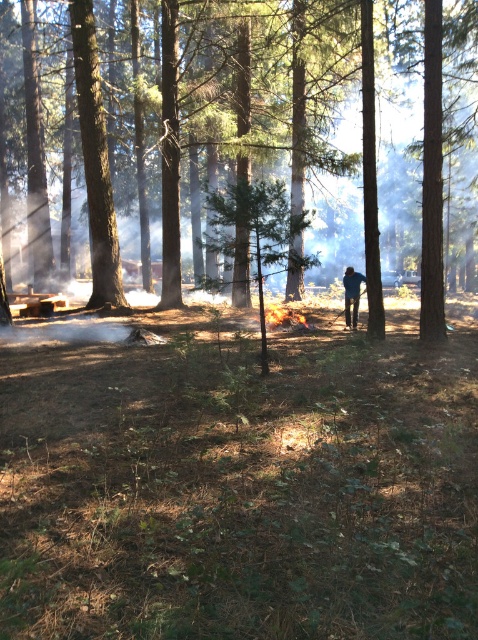
Does green textured tree at center have a lesser width compared to blue denim jeans at center?

No, green textured tree at center is not thinner than blue denim jeans at center.

Who is more forward, (434, 321) or (344, 285)?

Point (434, 321) is in front.

Describe the element at coordinates (262, 106) in the screenshot. The image size is (478, 640). I see `green textured tree at center` at that location.

Find the location of a particular element. This screenshot has height=640, width=478. green textured tree at center is located at coordinates (262, 106).